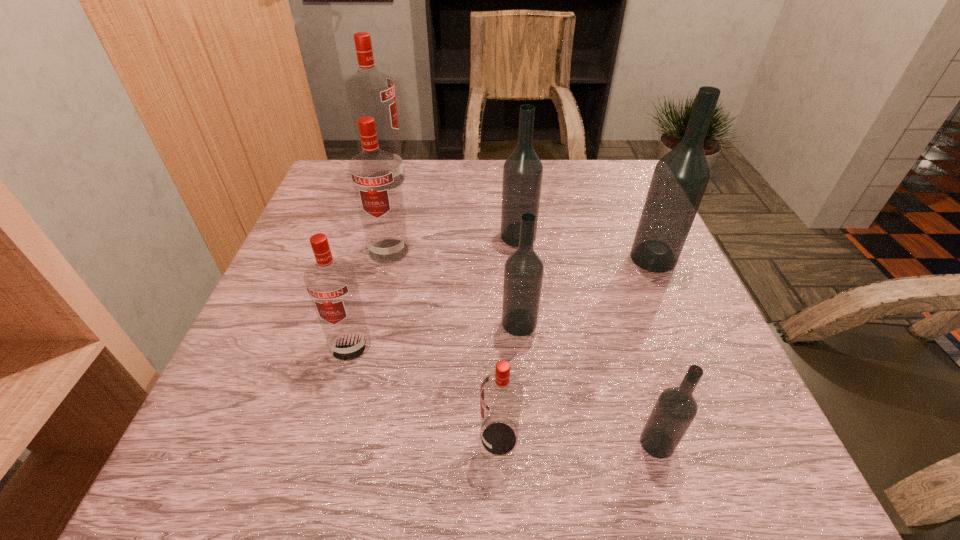
This screenshot has height=540, width=960. I want to click on vacant space that satisfies the following two spatial constraints: 1. on the front label of the farthest vodka; 2. on the back side of the rightmost black vodka, so click(x=362, y=258).

The height and width of the screenshot is (540, 960). In order to click on vacant space that satisfies the following two spatial constraints: 1. on the front label of the rightmost red vodka; 2. on the back side of the seventh object from left to right in this screenshot , I will do `click(499, 443)`.

Where is `vacant region that satisfies the following two spatial constraints: 1. on the front label of the farthest object; 2. on the left side of the biggest black vodka`? vacant region that satisfies the following two spatial constraints: 1. on the front label of the farthest object; 2. on the left side of the biggest black vodka is located at coordinates (362, 258).